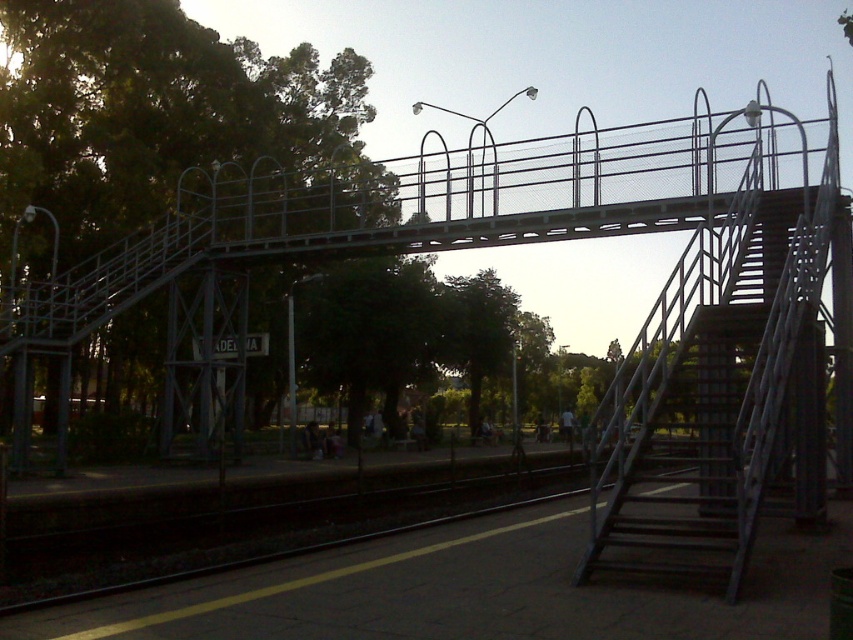
Can you confirm if green leafy tree at upper center is smaller than metallic gray staircase at center?

No.

Is green leafy tree at upper center positioned behind metallic gray staircase at center?

Yes, green leafy tree at upper center is further from the viewer.

Identify the location of green leafy tree at upper center. This screenshot has height=640, width=853. (213, 244).

What do you see at coordinates (708, 396) in the screenshot?
I see `metallic gray staircase at center` at bounding box center [708, 396].

Who is positioned more to the left, metallic gray staircase at center or green leafy tree at center?

From the viewer's perspective, green leafy tree at center appears more on the left side.

The width and height of the screenshot is (853, 640). In order to click on metallic gray staircase at center in this screenshot , I will do `click(708, 396)`.

The image size is (853, 640). Identify the location of metallic gray staircase at center. (708, 396).

Between point (257, 161) and point (463, 358), which one is positioned in front?

Point (257, 161)

Identify the location of green leafy tree at upper center. The height and width of the screenshot is (640, 853). (213, 244).

Is point (267, 67) closer to viewer compared to point (496, 301)?

Yes.

Where is `green leafy tree at upper center`? The height and width of the screenshot is (640, 853). green leafy tree at upper center is located at coordinates (213, 244).